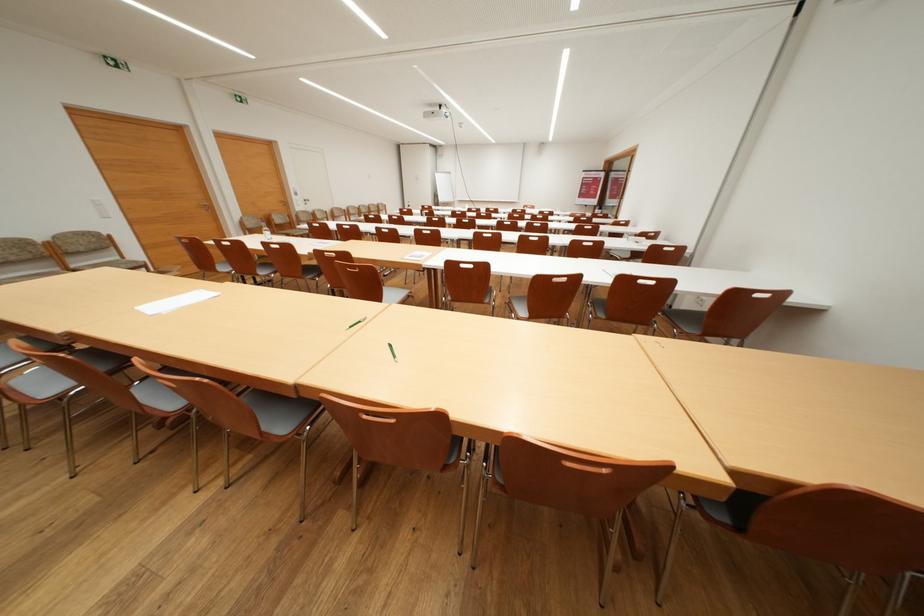
At what (x,y) coordinates should I click in order to perform the action: click on screen pull rod. Please return your answer as a coordinate pair (x, y). This screenshot has height=616, width=924. Looking at the image, I should click on (590, 187).